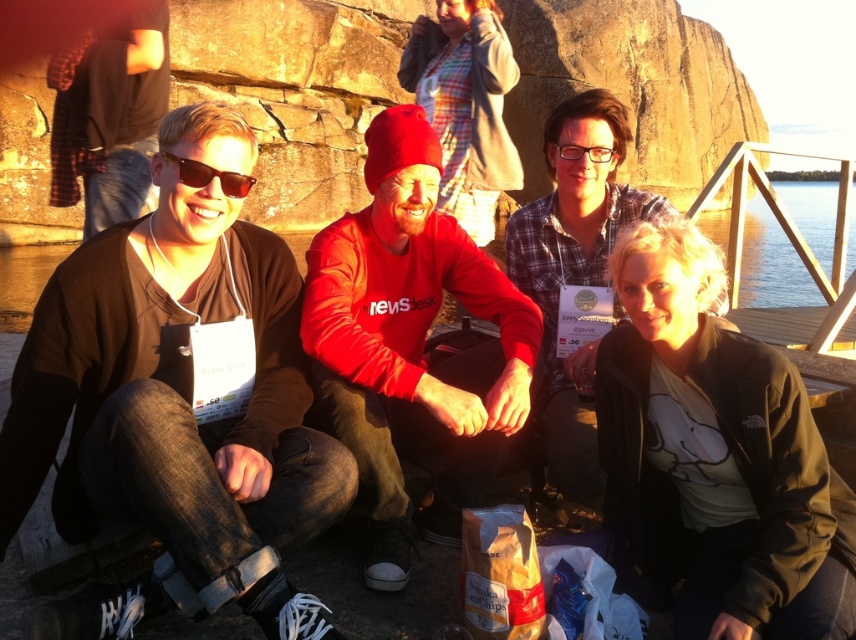
Between matte black sunglasses at left and clear plastic glasses at center, which one has more height?

matte black sunglasses at left is taller.

Can you confirm if matte black sunglasses at left is positioned to the left of clear plastic glasses at center?

Indeed, matte black sunglasses at left is positioned on the left side of clear plastic glasses at center.

Is point (241, 188) in front of point (556, 145)?

Yes, point (241, 188) is closer to viewer.

This screenshot has width=856, height=640. Identify the location of matte black sunglasses at left. (210, 176).